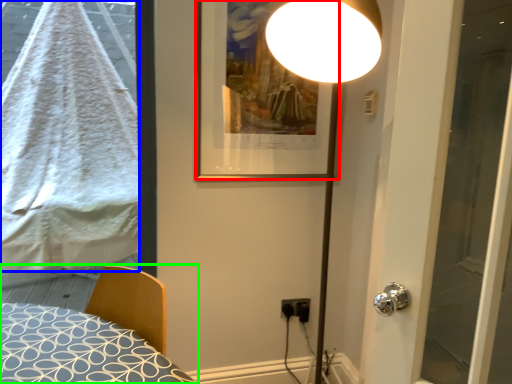
Question: Which object is the closest to the picture frame (highlighted by a red box)? Choose among these: blanket (highlighted by a blue box) or bed (highlighted by a green box).

Choices:
 (A) blanket
 (B) bed

Answer: (B)